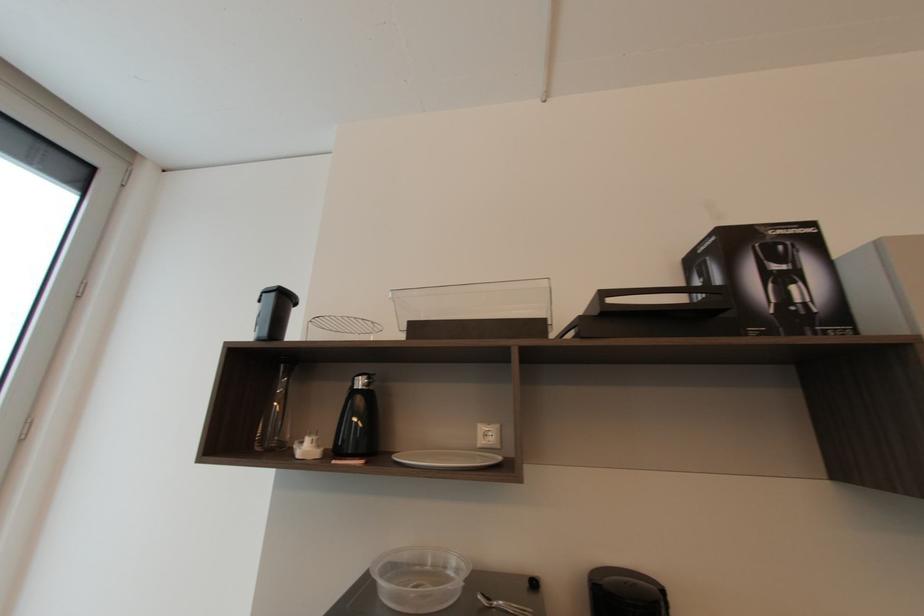
The image size is (924, 616). In order to click on clear plastic container in this screenshot , I will do `click(419, 578)`.